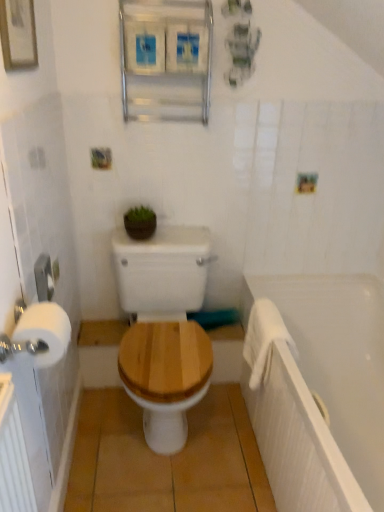
Question: From their relative heights in the image, would you say metallic silver medicine cabinet at upper center is taller or shorter than green matte plant at upper center?

Choices:
 (A) short
 (B) tall

Answer: (B)

Question: In terms of width, does metallic silver medicine cabinet at upper center look wider or thinner when compared to green matte plant at upper center?

Choices:
 (A) wide
 (B) thin

Answer: (B)

Question: Which object is positioned closest to the green matte plant at upper center?

Choices:
 (A) white plastic towel bar at left
 (B) white soft towel at right
 (C) metallic silver medicine cabinet at upper center
 (D) white matte bathtub at right
 (E) white matte toilet paper at left

Answer: (A)

Question: Which object is the farthest from the wooden toilet seat at center?

Choices:
 (A) white plastic towel bar at left
 (B) metallic silver medicine cabinet at upper center
 (C) green matte plant at upper center
 (D) white matte toilet paper at left
 (E) white soft towel at right

Answer: (B)